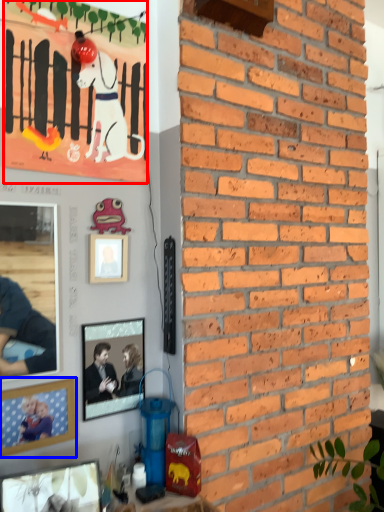
Question: Which object is further to the camera taking this photo, poster (highlighted by a red box) or picture frame (highlighted by a blue box)?

Choices:
 (A) poster
 (B) picture frame

Answer: (A)